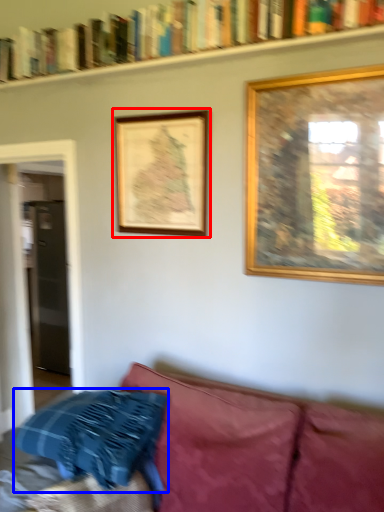
Question: Among these objects, which one is farthest to the camera, picture frame (highlighted by a red box) or pillow (highlighted by a blue box)?

Choices:
 (A) picture frame
 (B) pillow

Answer: (A)